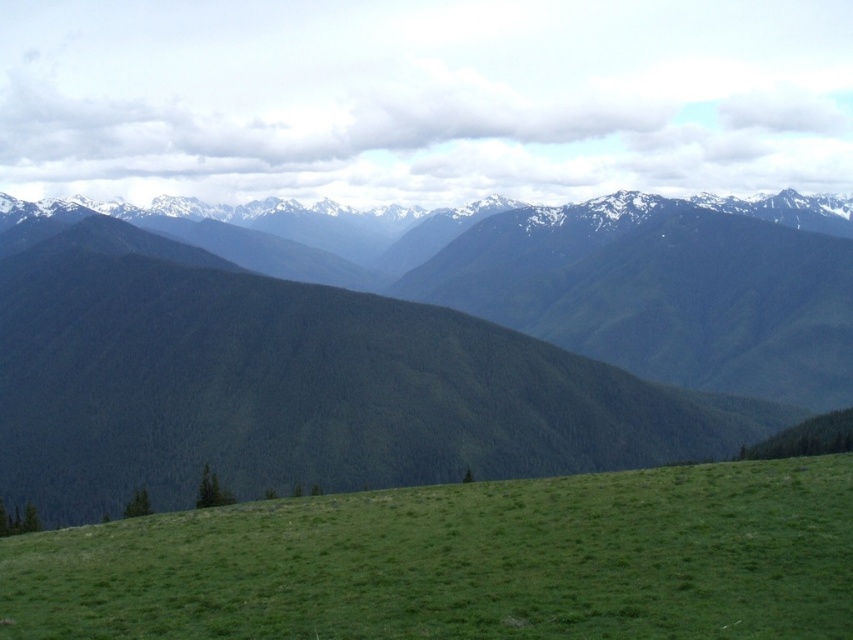
Question: Which object appears farthest from the camera in this image?

Choices:
 (A) green forested mountain at center
 (B) green grassy hill at lower center

Answer: (A)

Question: Is green forested mountain at center below green grassy hill at lower center?

Choices:
 (A) no
 (B) yes

Answer: (A)

Question: Is green forested mountain at center to the right of green grassy hill at lower center from the viewer's perspective?

Choices:
 (A) no
 (B) yes

Answer: (B)

Question: Does green forested mountain at center appear on the left side of green grassy hill at lower center?

Choices:
 (A) yes
 (B) no

Answer: (B)

Question: Among these objects, which one is nearest to the camera?

Choices:
 (A) green grassy hill at lower center
 (B) green forested mountain at center

Answer: (A)

Question: Which of the following is the farthest from the observer?

Choices:
 (A) green forested mountain at center
 (B) green grassy hill at lower center

Answer: (A)